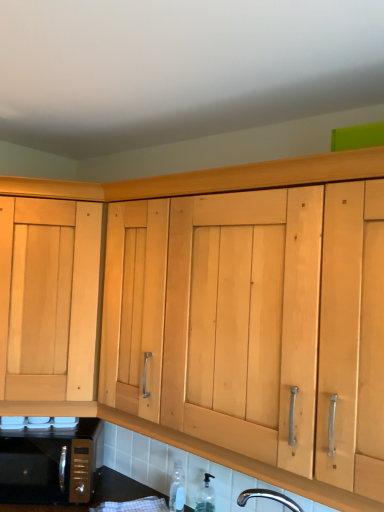
Question: Is clear glass bottle at lower center, marked as the second bottle in a left-to-right arrangement, closer to the viewer compared to light wood cabinet at left?

Choices:
 (A) no
 (B) yes

Answer: (A)

Question: Considering the relative sizes of clear glass bottle at lower center, which appears as the first bottle when viewed from the right, and light wood cabinet at left in the image provided, is clear glass bottle at lower center, which appears as the first bottle when viewed from the right, shorter than light wood cabinet at left?

Choices:
 (A) yes
 (B) no

Answer: (A)

Question: Is clear glass bottle at lower center, marked as the second bottle in a left-to-right arrangement, facing towards light wood cabinet at left?

Choices:
 (A) no
 (B) yes

Answer: (A)

Question: From a real-world perspective, is clear glass bottle at lower center, which appears as the first bottle when viewed from the right, located higher than light wood cabinet at left?

Choices:
 (A) yes
 (B) no

Answer: (B)

Question: Is clear glass bottle at lower center, marked as the second bottle in a left-to-right arrangement, touching light wood cabinet at left?

Choices:
 (A) yes
 (B) no

Answer: (B)

Question: From a real-world perspective, is clear glass bottle at lower center, marked as the second bottle in a left-to-right arrangement, below light wood cabinet at left?

Choices:
 (A) yes
 (B) no

Answer: (A)

Question: Is clear glass bottle at lower center, which appears as the first bottle when viewed from the right, in front of black metallic microwave at lower left?

Choices:
 (A) yes
 (B) no

Answer: (A)

Question: Is clear glass bottle at lower center, which appears as the first bottle when viewed from the right, far away from black metallic microwave at lower left?

Choices:
 (A) yes
 (B) no

Answer: (B)

Question: Can you confirm if clear glass bottle at lower center, marked as the second bottle in a left-to-right arrangement, is positioned to the left of black metallic microwave at lower left?

Choices:
 (A) yes
 (B) no

Answer: (B)

Question: From the image's perspective, is clear glass bottle at lower center, which appears as the first bottle when viewed from the right, below black metallic microwave at lower left?

Choices:
 (A) no
 (B) yes

Answer: (B)

Question: Would you say clear glass bottle at lower center, which appears as the first bottle when viewed from the right, is outside black metallic microwave at lower left?

Choices:
 (A) yes
 (B) no

Answer: (A)

Question: Does clear glass bottle at lower center, marked as the second bottle in a left-to-right arrangement, have a lesser width compared to black metallic microwave at lower left?

Choices:
 (A) no
 (B) yes

Answer: (B)

Question: From the image's perspective, is transparent plastic bottle at lower center, acting as the second bottle starting from the right, on top of light wood cabinet at left?

Choices:
 (A) no
 (B) yes

Answer: (A)